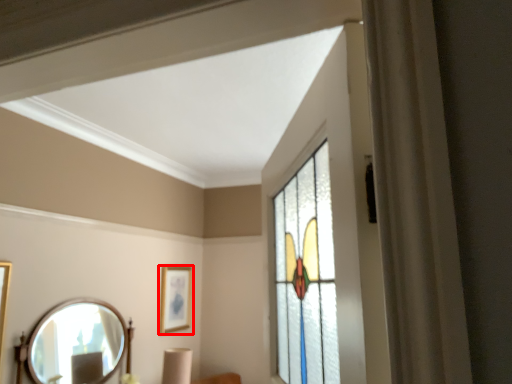
Question: From the image's perspective, considering the relative positions of picture frame (annotated by the red box) and mirror in the image provided, where is picture frame (annotated by the red box) located with respect to the staircase?

Choices:
 (A) below
 (B) above

Answer: (B)